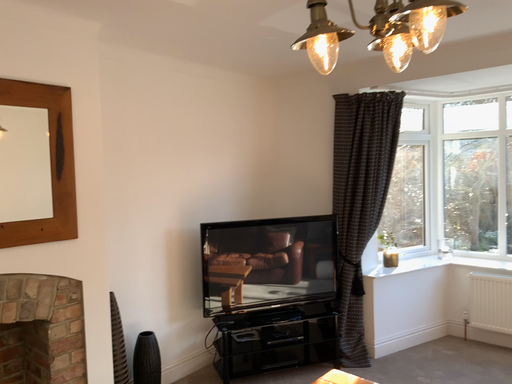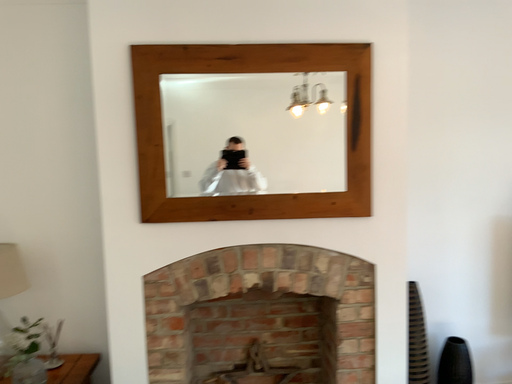
Question: How did the camera likely rotate when shooting the video?

Choices:
 (A) rotated right
 (B) rotated left

Answer: (B)